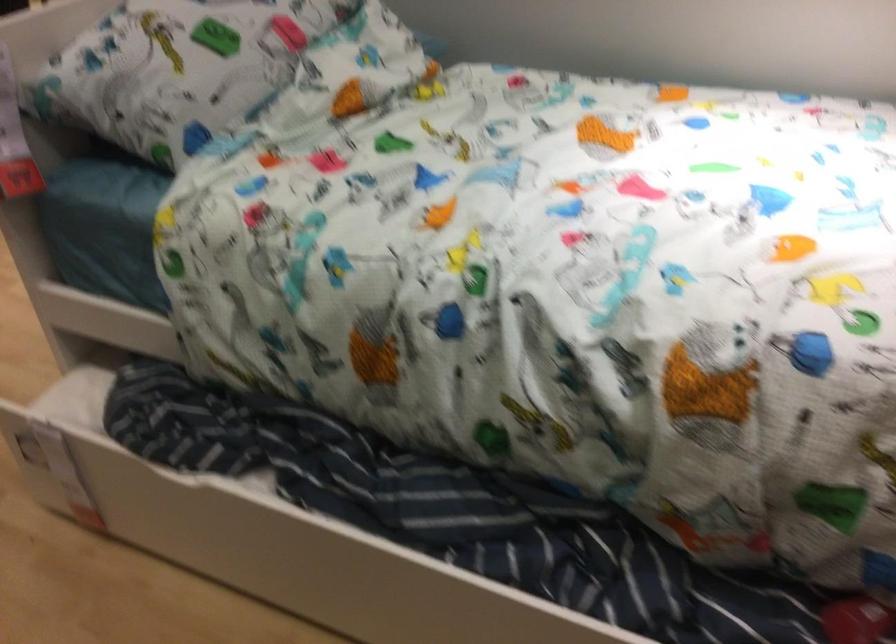
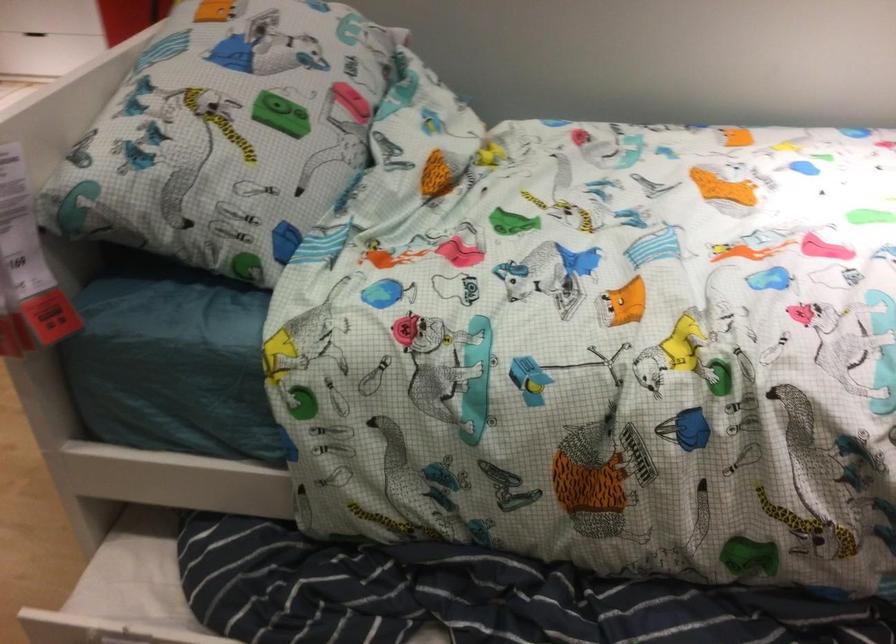
Question: Based on the continuous images, in which direction is the camera rotating? Reply with the corresponding letter.

Choices:
 (A) Left
 (B) Right
 (C) Up
 (D) Down

Answer: (B)